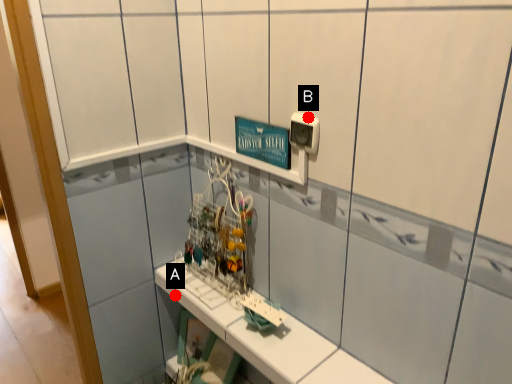
Question: Two points are circled on the image, labeled by A and B beside each circle. Which point is further to the camera?

Choices:
 (A) A is further
 (B) B is further

Answer: (A)